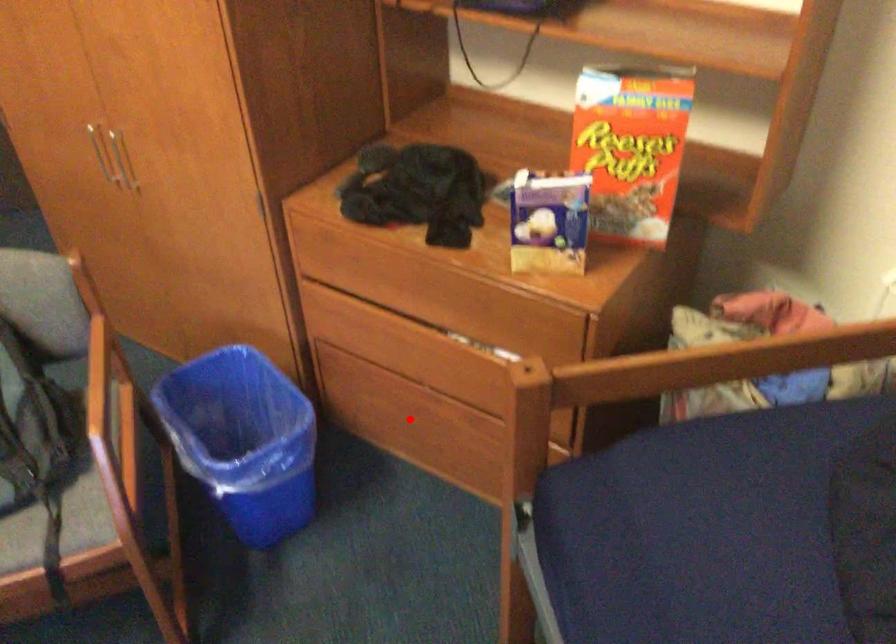
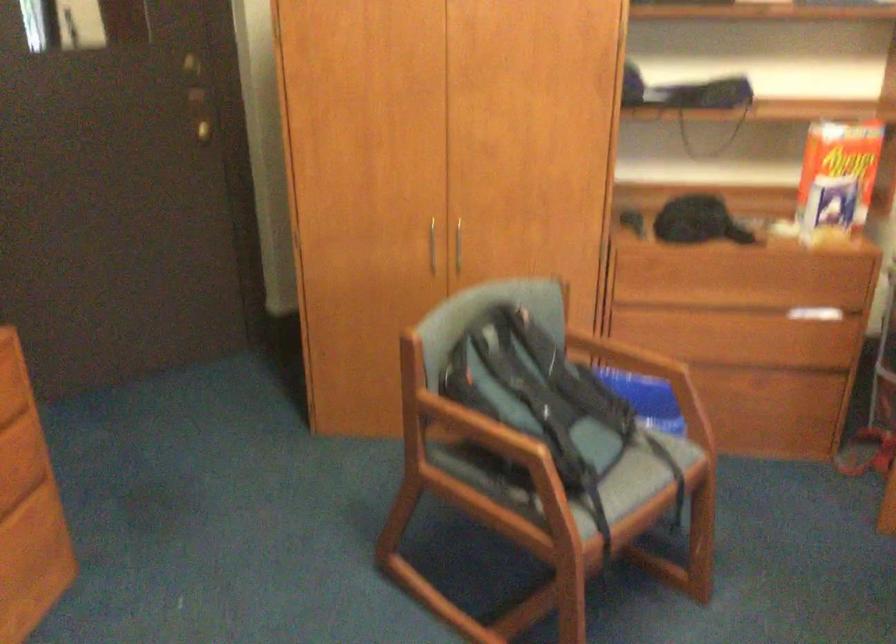
Question: I am providing you with two images of the same scene from different viewpoints. A red point is marked on the first image. Can you still see the location of the red point in image 2?

Choices:
 (A) Yes
 (B) No

Answer: (B)